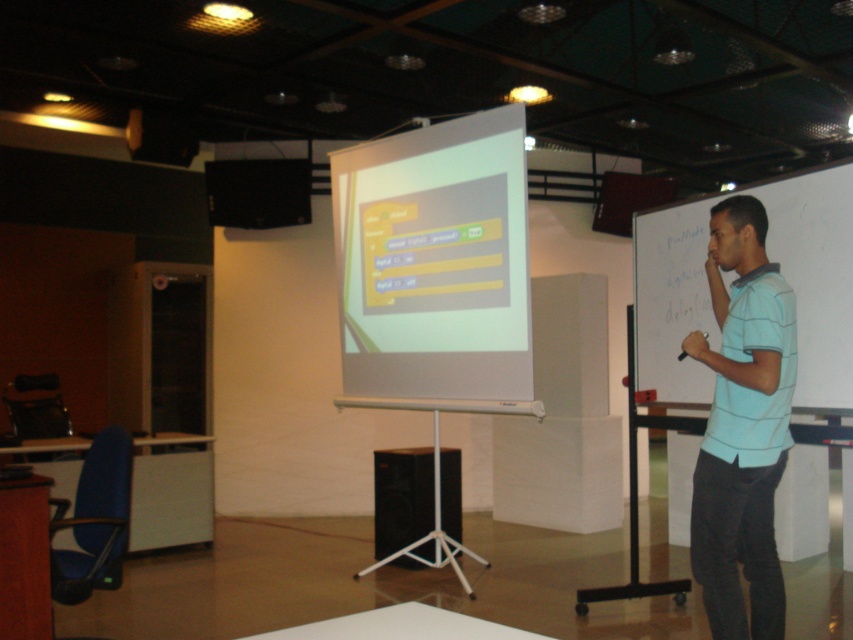
You are attending a presentation in the room. You need to locate the speaker who is wearing a light blue striped shirt at right. Where is this speaker positioned relative to the black plastic speaker at upper left?

The light blue striped shirt at right is positioned to the right of the black plastic speaker at upper left.

Based on the photo, you are attending a presentation and notice two items in the room. The light blue striped shirt at right and the black plastic speaker at upper left. Which item takes up more space in the image?

The light blue striped shirt at right takes up more space in the image as it is larger in size than the black plastic speaker at upper left.

You are organizing a presentation and need to ensure that the light blue striped shirt at right and the black matte speaker at center can both fit on a shelf that is 1 meter wide. Based on their sizes, will they both fit?

The light blue striped shirt at right is narrower than the black matte speaker at center. However, without knowing the exact width of the speaker, we cannot confirm if their combined width is less than 1 meter. More information is needed.